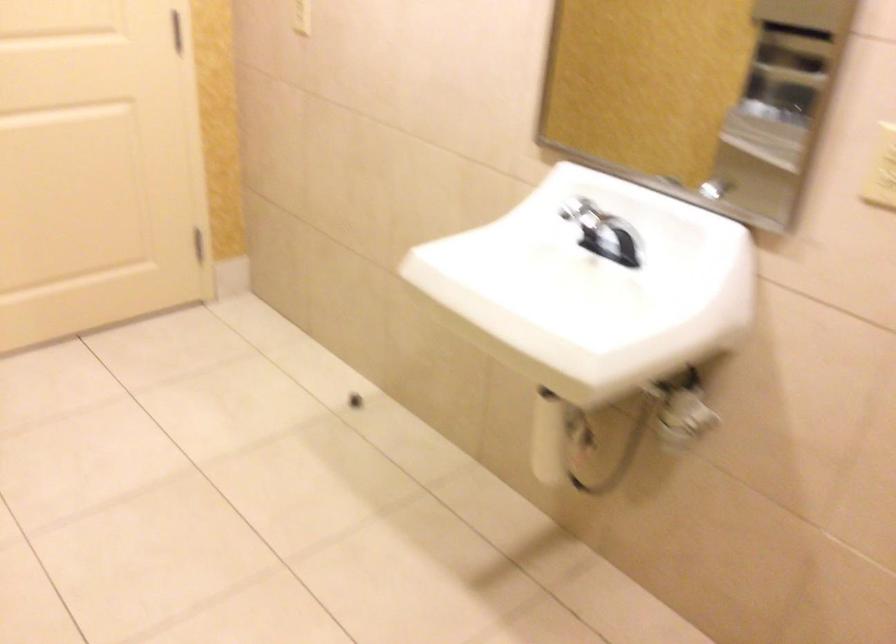
Where is `faucet handle`? Image resolution: width=896 pixels, height=644 pixels. faucet handle is located at coordinates (581, 213).